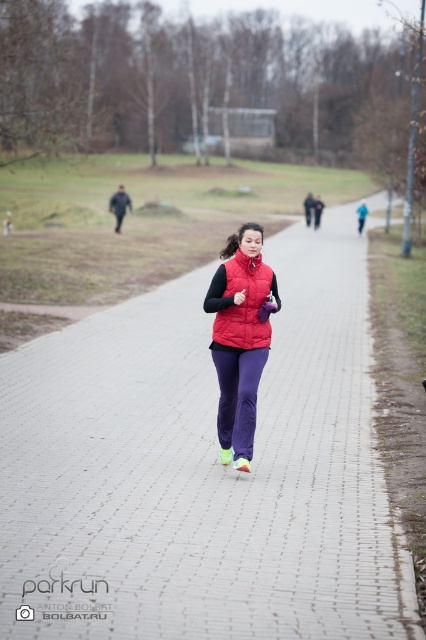
You are a runner in the parkrun event. You notice the brick paved path at center and the matte red vest at center. Which object is closer to you as you face the scene?

The brick paved path at center is in front of the matte red vest at center, so it is closer to you when facing the scene.